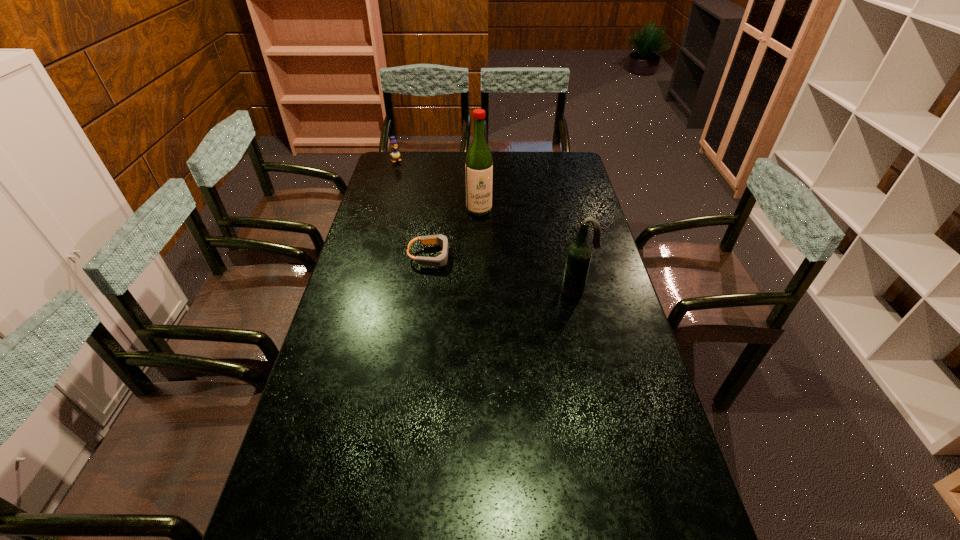
Locate an element on the screen. This screenshot has width=960, height=540. the shortest object is located at coordinates (440, 261).

Identify the location of the third farthest object. The width and height of the screenshot is (960, 540). (440, 261).

The width and height of the screenshot is (960, 540). What are the coordinates of `beer bottle` in the screenshot? It's located at (579, 253).

You are a GUI agent. You are given a task and a screenshot of the screen. Output one action in this format:
    pyautogui.click(x=<x>, y=<y>)
    Task: Click on the third shortest object
    
    Given the screenshot: What is the action you would take?
    pyautogui.click(x=579, y=253)

Where is `the second object from right to left`? The height and width of the screenshot is (540, 960). the second object from right to left is located at coordinates (479, 163).

Where is `the tallest object`? Image resolution: width=960 pixels, height=540 pixels. the tallest object is located at coordinates coord(479,163).

You are a GUI agent. You are given a task and a screenshot of the screen. Output one action in this format:
    pyautogui.click(x=<x>, y=<y>)
    Task: Click on the leftmost object
    This screenshot has width=960, height=540.
    Given the screenshot: What is the action you would take?
    pyautogui.click(x=395, y=154)

Locate an element on the screen. Image resolution: width=960 pixels, height=540 pixels. duckling is located at coordinates (395, 154).

The width and height of the screenshot is (960, 540). Identify the location of blank space located 0.210m on the front and back of the second nearest object. (513, 256).

Identify the location of vacant position located on the back of the third shortest object. This screenshot has height=540, width=960. (563, 230).